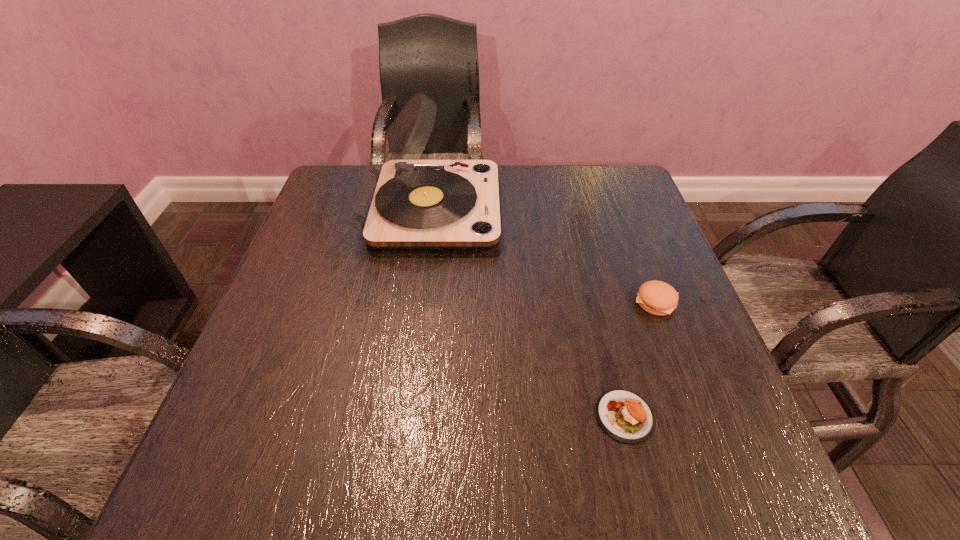
Find the location of a particular element. This screenshot has width=960, height=540. free space that satisfies the following two spatial constraints: 1. on the back side of the nearer patty (food); 2. with the tonearm facing the front of the farthest object is located at coordinates (573, 209).

Identify the location of free space that satisfies the following two spatial constraints: 1. with the tonearm facing the front of the second farthest object; 2. on the left side of the tallest object. (420, 301).

I want to click on blank space that satisfies the following two spatial constraints: 1. with the tonearm facing the front of the tallest object; 2. on the left side of the left patty (food), so click(x=404, y=416).

This screenshot has width=960, height=540. What are the coordinates of `free region that satisfies the following two spatial constraints: 1. with the tonearm facing the front of the farthest object; 2. on the right side of the second tallest object` in the screenshot? It's located at (420, 301).

At what (x,y) coordinates should I click in order to perform the action: click on free space that satisfies the following two spatial constraints: 1. with the tonearm facing the front of the record player; 2. on the left side of the shorter patty (food). Please return your answer as a coordinate pair (x, y). The height and width of the screenshot is (540, 960). Looking at the image, I should click on (404, 416).

At what (x,y) coordinates should I click in order to perform the action: click on free space that satisfies the following two spatial constraints: 1. with the tonearm facing the front of the record player; 2. on the left side of the second tallest object. Please return your answer as a coordinate pair (x, y). This screenshot has width=960, height=540. Looking at the image, I should click on (420, 301).

Identify the location of free space that satisfies the following two spatial constraints: 1. on the back side of the right patty (food); 2. with the tonearm facing the front of the farthest object. (621, 209).

Where is `free space that satisfies the following two spatial constraints: 1. on the back side of the farther patty (food); 2. with the tonearm facing the front of the leftmost object`? This screenshot has width=960, height=540. free space that satisfies the following two spatial constraints: 1. on the back side of the farther patty (food); 2. with the tonearm facing the front of the leftmost object is located at coordinates (621, 209).

You are a GUI agent. You are given a task and a screenshot of the screen. Output one action in this format:
    pyautogui.click(x=<x>, y=<y>)
    Task: Click on the vacant area that satisfies the following two spatial constraints: 1. with the tonearm facing the front of the record player; 2. on the right side of the second shortest object
    This screenshot has height=540, width=960.
    Given the screenshot: What is the action you would take?
    pyautogui.click(x=420, y=301)

At what (x,y) coordinates should I click in order to perform the action: click on vacant space that satisfies the following two spatial constraints: 1. on the back side of the nearer patty (food); 2. with the tonearm facing the front of the leftmost object. Please return your answer as a coordinate pair (x, y). The height and width of the screenshot is (540, 960). Looking at the image, I should click on (573, 209).